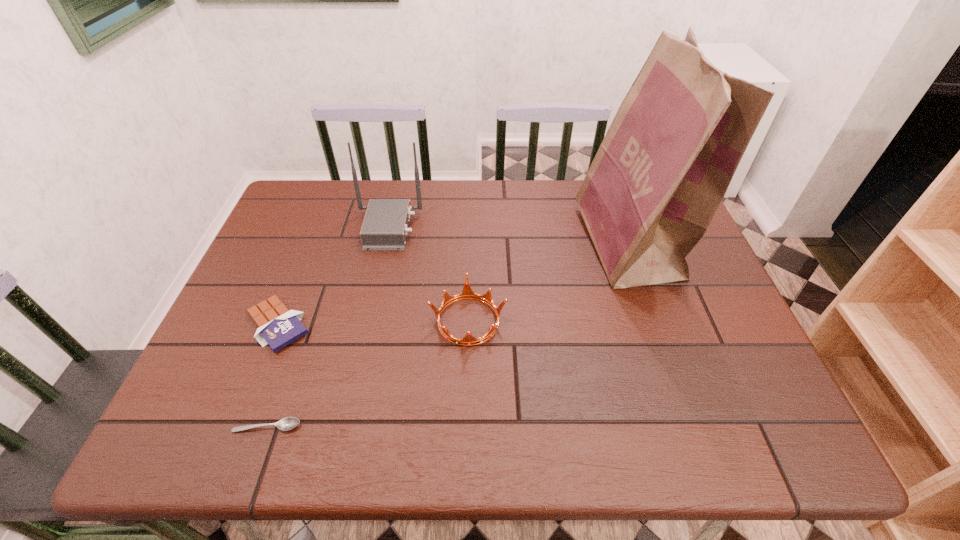
Identify the location of grocery bag. (662, 170).

Where is `the tallest object`? Image resolution: width=960 pixels, height=540 pixels. the tallest object is located at coordinates (662, 170).

Locate an element on the screen. router is located at coordinates (385, 226).

Image resolution: width=960 pixels, height=540 pixels. What are the coordinates of `the second object from right to left` in the screenshot? It's located at (467, 293).

The width and height of the screenshot is (960, 540). In order to click on crown in this screenshot , I will do `click(467, 293)`.

Identify the location of chocolate bar. (277, 326).

This screenshot has width=960, height=540. What are the coordinates of `the shortest object` in the screenshot? It's located at (288, 423).

This screenshot has height=540, width=960. What are the coordinates of `soupspoon` in the screenshot? It's located at (x=288, y=423).

Identify the location of free space located on the front-facing side of the tallest object. (481, 243).

Find the location of a particular element. This screenshot has height=540, width=960. vacant space located on the front-facing side of the tallest object is located at coordinates coord(562,243).